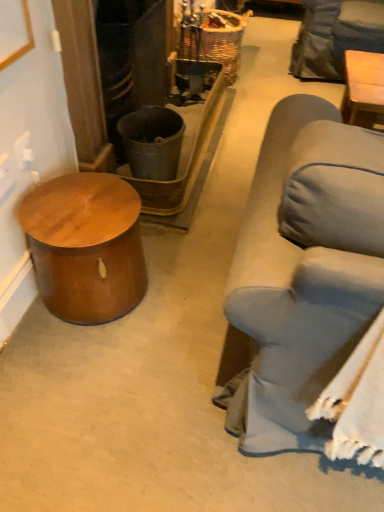
Question: Based on their positions, is woven brown basket at upper center located to the left or right of shiny brown wood side table at left?

Choices:
 (A) right
 (B) left

Answer: (A)

Question: From the image's perspective, relative to shiny brown wood side table at left, is woven brown basket at upper center above or below?

Choices:
 (A) above
 (B) below

Answer: (A)

Question: Looking at the image, does woven brown basket at upper center seem bigger or smaller compared to shiny brown wood side table at left?

Choices:
 (A) small
 (B) big

Answer: (B)

Question: Considering the positions of point (54, 216) and point (226, 65), is point (54, 216) closer or farther from the camera than point (226, 65)?

Choices:
 (A) farther
 (B) closer

Answer: (B)

Question: Is shiny brown wood side table at left wider or thinner than woven brown basket at upper center?

Choices:
 (A) thin
 (B) wide

Answer: (A)

Question: Is shiny brown wood side table at left inside the boundaries of woven brown basket at upper center, or outside?

Choices:
 (A) outside
 (B) inside

Answer: (A)

Question: Relative to woven brown basket at upper center, is shiny brown wood side table at left in front or behind?

Choices:
 (A) front
 (B) behind

Answer: (A)